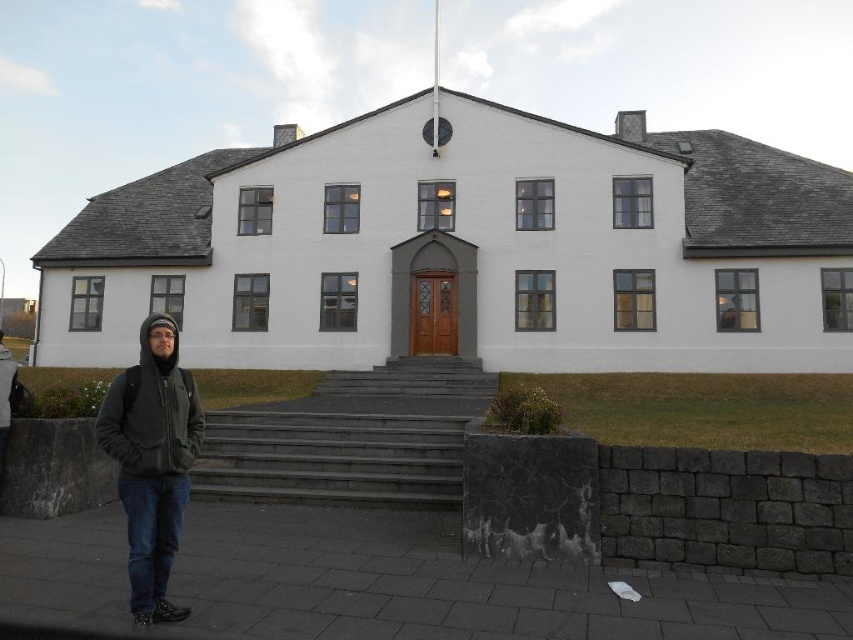
Question: Does dark gray concrete stairs at center have a lesser width compared to dark gray hoodie at lower left?

Choices:
 (A) no
 (B) yes

Answer: (A)

Question: Observing the image, what is the correct spatial positioning of white matte building at center in reference to dark gray concrete stairs at center?

Choices:
 (A) above
 (B) below

Answer: (A)

Question: Which object is farther from the camera taking this photo?

Choices:
 (A) dark gray hoodie at lower left
 (B) white matte building at center

Answer: (B)

Question: Is white matte building at center thinner than dark gray concrete stairs at center?

Choices:
 (A) no
 (B) yes

Answer: (A)

Question: Which point is farther to the camera?

Choices:
 (A) (488, 372)
 (B) (340, 333)

Answer: (B)

Question: Among these objects, which one is farthest from the camera?

Choices:
 (A) dark gray concrete stairs at center
 (B) white matte building at center

Answer: (B)